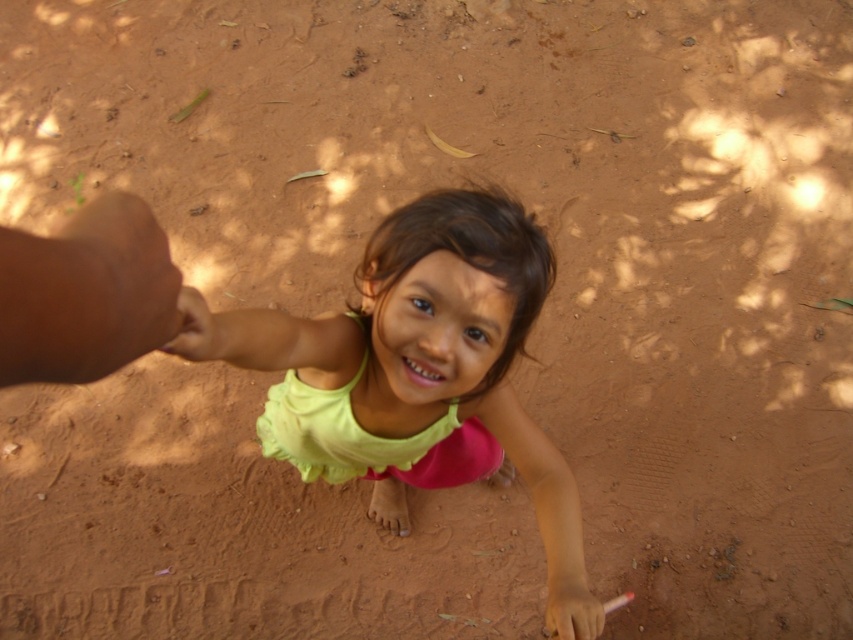
Question: Which object is farther from the camera taking this photo?

Choices:
 (A) light brown skin at lower left
 (B) pink matte toothbrush at lower center

Answer: (B)

Question: From the image, what is the correct spatial relationship of light green fabric dress at center in relation to pink matte toothbrush at lower center?

Choices:
 (A) above
 (B) below

Answer: (A)

Question: Where is light green fabric dress at center located in relation to pink matte toothbrush at lower center in the image?

Choices:
 (A) below
 (B) above

Answer: (B)

Question: Which object appears closest to the camera in this image?

Choices:
 (A) pink matte toothbrush at lower center
 (B) light green fabric dress at center

Answer: (B)

Question: Which object is closer to the camera taking this photo?

Choices:
 (A) pink matte toothbrush at lower center
 (B) light green fabric dress at center
 (C) light brown skin at lower left

Answer: (C)

Question: Is light green fabric dress at center thinner than light brown skin at lower left?

Choices:
 (A) no
 (B) yes

Answer: (A)